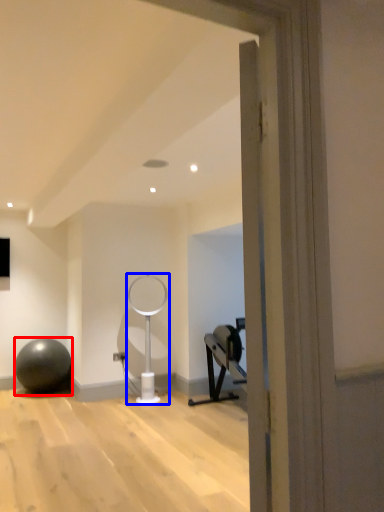
Question: Which point is closer to the camera, ball (highlighted by a red box) or table lamp (highlighted by a blue box)?

Choices:
 (A) ball
 (B) table lamp

Answer: (B)